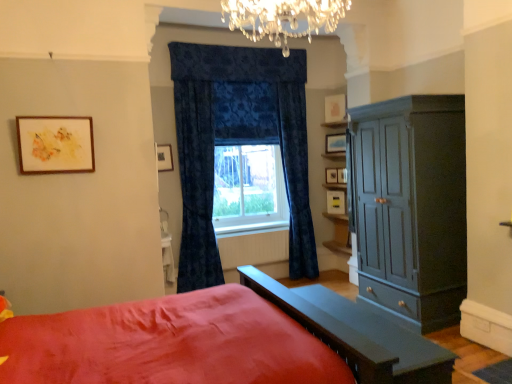
Question: Can you confirm if wooden picture frame at upper right, placed as the fifth picture frame when sorted from left to right, is shorter than matte gray table at lower center, which is counted as the 1th table, starting from the right?

Choices:
 (A) no
 (B) yes

Answer: (B)

Question: Is wooden picture frame at upper right, positioned as the 4th picture frame in back-to-front order, oriented towards matte gray table at lower center, positioned as the 2th table in left-to-right order?

Choices:
 (A) yes
 (B) no

Answer: (B)

Question: From a real-world perspective, is wooden picture frame at upper right, the 2th picture frame from the right, physically above matte gray table at lower center, which is counted as the 1th table, starting from the right?

Choices:
 (A) yes
 (B) no

Answer: (A)

Question: Is wooden picture frame at upper right, placed as the fifth picture frame when sorted from left to right, closer to camera compared to matte gray table at lower center, positioned as the 2th table in left-to-right order?

Choices:
 (A) yes
 (B) no

Answer: (B)

Question: Is wooden picture frame at upper right, which is counted as the 3th picture frame, starting from the front, smaller than matte gray table at lower center, which is the 1th table from front to back?

Choices:
 (A) yes
 (B) no

Answer: (A)

Question: Can you confirm if wooden picture frame at upper right, the 2th picture frame from the right, is taller than matte gray table at lower center, which is counted as the 1th table, starting from the right?

Choices:
 (A) yes
 (B) no

Answer: (B)

Question: Can you confirm if wooden picture frame at center, placed as the 1th picture frame when sorted from right to left, is taller than wooden picture frame at upper center, acting as the 6th picture frame starting from the front?

Choices:
 (A) no
 (B) yes

Answer: (B)

Question: Considering the relative positions of wooden picture frame at center, which is counted as the sixth picture frame, starting from the left, and wooden picture frame at upper center, the 3th picture frame when ordered from left to right, in the image provided, is wooden picture frame at center, which is counted as the sixth picture frame, starting from the left, to the left of wooden picture frame at upper center, the 3th picture frame when ordered from left to right, from the viewer's perspective?

Choices:
 (A) yes
 (B) no

Answer: (B)

Question: Is wooden picture frame at center, the fourth picture frame in the front-to-back sequence, smaller than wooden picture frame at upper center, the 3th picture frame when ordered from left to right?

Choices:
 (A) yes
 (B) no

Answer: (A)

Question: Does wooden picture frame at center, which is the third picture frame in back-to-front order, have a lesser height compared to wooden picture frame at upper center, which is the first picture frame from back to front?

Choices:
 (A) no
 (B) yes

Answer: (A)

Question: Does wooden picture frame at center, which is the third picture frame in back-to-front order, touch wooden picture frame at upper center, which is the first picture frame from back to front?

Choices:
 (A) no
 (B) yes

Answer: (B)

Question: From the image's perspective, is wooden picture frame at center, which is the third picture frame in back-to-front order, over wooden picture frame at upper center, positioned as the 4th picture frame in right-to-left order?

Choices:
 (A) no
 (B) yes

Answer: (A)

Question: Is white glossy table at lower center, acting as the 2th table starting from the right, positioned in front of white painted radiator at center?

Choices:
 (A) yes
 (B) no

Answer: (A)